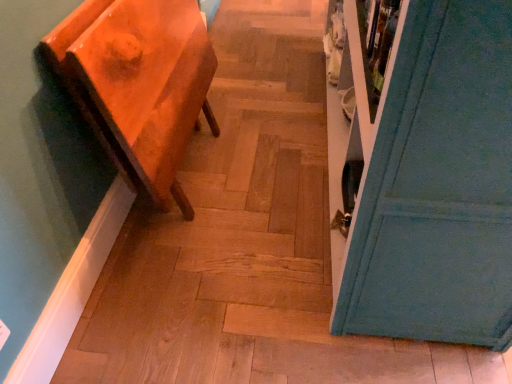
Question: Is matte orange side table at left outside of teal painted door at right?

Choices:
 (A) yes
 (B) no

Answer: (A)

Question: From a real-world perspective, is matte orange side table at left located beneath teal painted door at right?

Choices:
 (A) yes
 (B) no

Answer: (A)

Question: Is teal painted door at right surrounded by matte orange side table at left?

Choices:
 (A) yes
 (B) no

Answer: (B)

Question: From the image's perspective, is matte orange side table at left above teal painted door at right?

Choices:
 (A) yes
 (B) no

Answer: (B)

Question: Is matte orange side table at left oriented away from teal painted door at right?

Choices:
 (A) yes
 (B) no

Answer: (B)

Question: From the image's perspective, is matte orange side table at left located beneath teal painted door at right?

Choices:
 (A) yes
 (B) no

Answer: (A)

Question: Is the position of teal painted door at right more distant than that of matte orange side table at left?

Choices:
 (A) no
 (B) yes

Answer: (A)

Question: Is teal painted door at right positioned with its back to matte orange side table at left?

Choices:
 (A) yes
 (B) no

Answer: (A)

Question: Can you confirm if teal painted door at right is bigger than matte orange side table at left?

Choices:
 (A) no
 (B) yes

Answer: (B)

Question: Is teal painted door at right thinner than matte orange side table at left?

Choices:
 (A) no
 (B) yes

Answer: (A)

Question: From a real-world perspective, does teal painted door at right stand above matte orange side table at left?

Choices:
 (A) yes
 (B) no

Answer: (A)

Question: Is teal painted door at right oriented towards matte orange side table at left?

Choices:
 (A) yes
 (B) no

Answer: (A)

Question: Considering their positions, is teal painted door at right located in front of or behind matte orange side table at left?

Choices:
 (A) front
 (B) behind

Answer: (A)